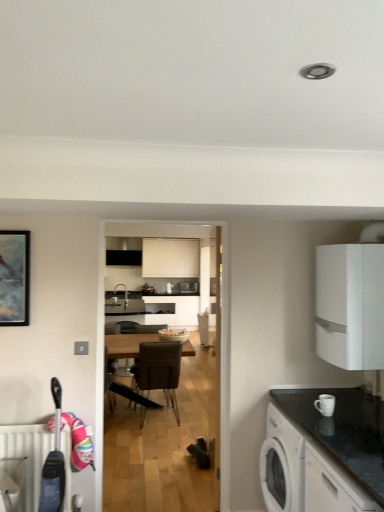
Question: In terms of height, does white matte cabinet at right, which ranks as the 2th cabinetry in front-to-back order, look taller or shorter compared to matte white bowl at center?

Choices:
 (A) tall
 (B) short

Answer: (A)

Question: Relative to matte white bowl at center, is white matte cabinet at right, positioned as the 1th cabinetry in back-to-front order, in front or behind?

Choices:
 (A) behind
 (B) front

Answer: (B)

Question: Which of these objects is positioned farthest from the white matte cabinet at right, the second cabinetry positioned from the bottom?

Choices:
 (A) white ceramic mug at lower right
 (B) black granite countertop at right
 (C) matte white bowl at center
 (D) white textured radiator at lower left
 (E) wooden table at center

Answer: (C)

Question: Based on their relative distances, which object is farther from the wooden table at center?

Choices:
 (A) white textured radiator at lower left
 (B) matte white bowl at center
 (C) white matte cabinet at lower right, the 1th cabinetry in the bottom-to-top sequence
 (D) brown leather chair at center
 (E) white ceramic mug at lower right

Answer: (C)